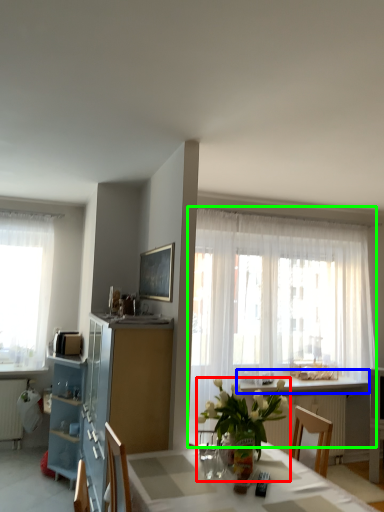
Question: Considering the real-world distances, which object is closest to houseplant (highlighted by a red box)? counter top (highlighted by a blue box) or curtain (highlighted by a green box).

Choices:
 (A) counter top
 (B) curtain

Answer: (A)